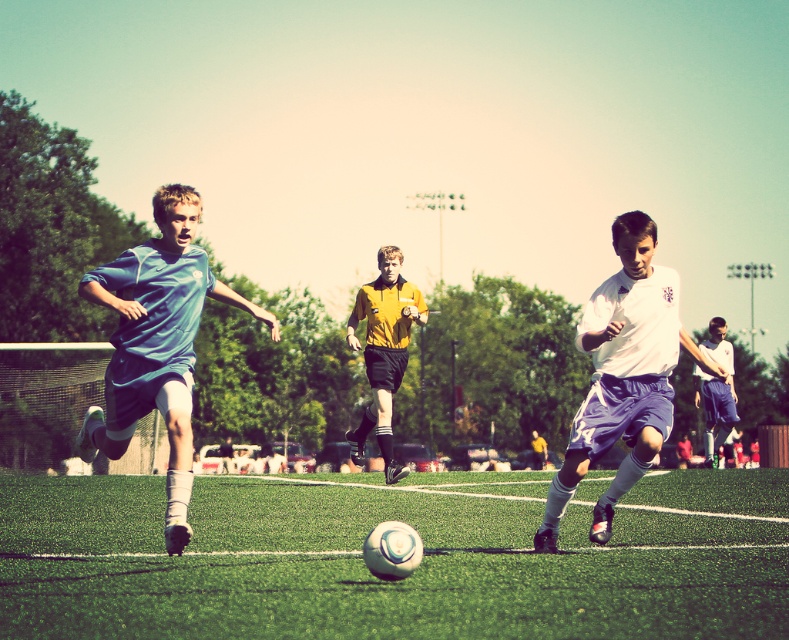
Between matte blue jersey at center and yellow matte shirt at center, which one appears on the left side from the viewer's perspective?

matte blue jersey at center

Is matte blue jersey at center to the right of yellow matte shirt at center from the viewer's perspective?

In fact, matte blue jersey at center is to the left of yellow matte shirt at center.

What do you see at coordinates (156, 342) in the screenshot? I see `matte blue jersey at center` at bounding box center [156, 342].

Find the location of a particular element. This screenshot has width=789, height=640. matte blue jersey at center is located at coordinates (156, 342).

Between green artificial turf at center and white jersey at center, which one appears on the left side from the viewer's perspective?

From the viewer's perspective, green artificial turf at center appears more on the left side.

Where is `green artificial turf at center`? This screenshot has height=640, width=789. green artificial turf at center is located at coordinates (391, 580).

This screenshot has width=789, height=640. What do you see at coordinates (391, 580) in the screenshot? I see `green artificial turf at center` at bounding box center [391, 580].

What are the coordinates of `green artificial turf at center` in the screenshot? It's located at (391, 580).

Is point (653, 244) in front of point (711, 432)?

Yes, point (653, 244) is closer to viewer.

Is white matte soccer player at center above white jersey at center?

Yes, white matte soccer player at center is above white jersey at center.

Who is more distant from viewer, (585, 449) or (720, 413)?

The point (720, 413) is behind.

The image size is (789, 640). In order to click on white matte soccer player at center in this screenshot , I will do `click(623, 376)`.